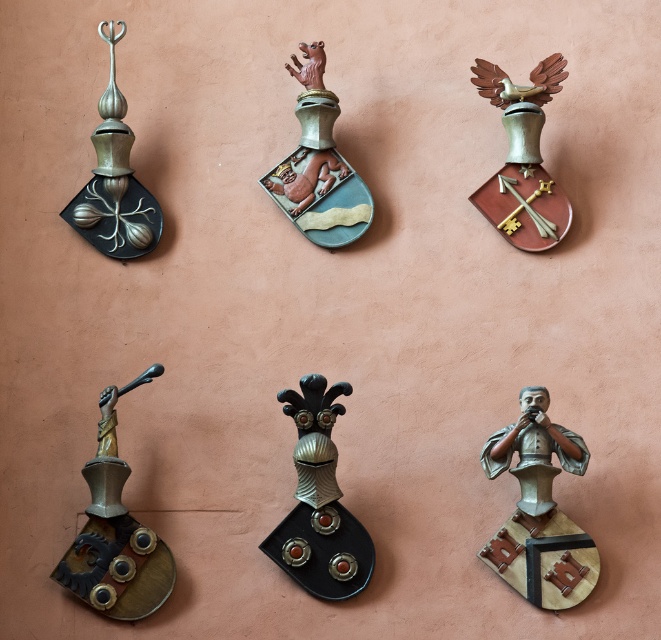
Is bronze metallic bust at center bigger than metallic black shield at center?

Yes.

Is point (539, 440) positioned before point (336, 595)?

Yes.

This screenshot has height=640, width=661. I want to click on bronze metallic bust at center, so click(x=539, y=509).

This screenshot has height=640, width=661. I want to click on brass/bronze statue at lower left, so click(114, 532).

How distant is brass/bronze statue at lower left from polished brass shield with crossed keys at upper right?

brass/bronze statue at lower left and polished brass shield with crossed keys at upper right are 33.60 inches apart.

Image resolution: width=661 pixels, height=640 pixels. What are the coordinates of `brass/bronze statue at lower left` in the screenshot? It's located at (114, 532).

Where is `brass/bronze statue at lower left`? The image size is (661, 640). brass/bronze statue at lower left is located at coordinates (114, 532).

The width and height of the screenshot is (661, 640). What do you see at coordinates (522, 157) in the screenshot?
I see `polished brass shield with crossed keys at upper right` at bounding box center [522, 157].

Is polished brass shield with crossed keys at upper right taller than matte bronze shield at upper left?

In fact, polished brass shield with crossed keys at upper right may be shorter than matte bronze shield at upper left.

Is point (553, 234) less distant than point (151, 212)?

Yes, point (553, 234) is closer to viewer.

Where is `polished brass shield with crossed keys at upper right`? The width and height of the screenshot is (661, 640). polished brass shield with crossed keys at upper right is located at coordinates (522, 157).